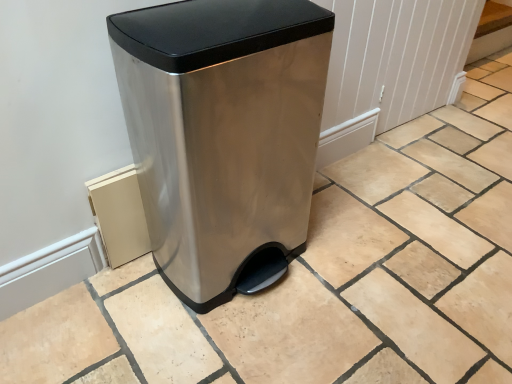
At what (x,y) coordinates should I click in order to perform the action: click on vacant space to the right of stainless steel trash can at center. Please return your answer as a coordinate pair (x, y). This screenshot has height=384, width=512. Looking at the image, I should click on (366, 263).